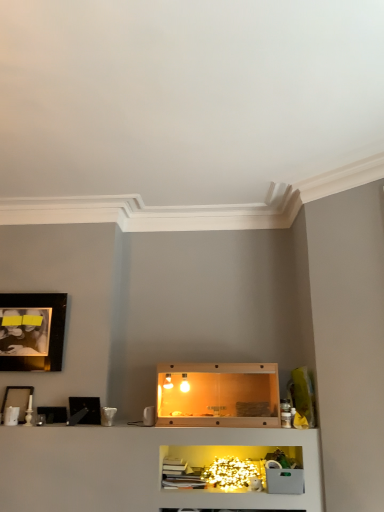
Question: Would you say translucent glass shelf at center is to the left or to the right of black glossy picture frame at left, acting as the third picture frame starting from the top, in the picture?

Choices:
 (A) right
 (B) left

Answer: (A)

Question: From the image's perspective, is translucent glass shelf at center positioned above or below black glossy picture frame at left, acting as the third picture frame starting from the top?

Choices:
 (A) above
 (B) below

Answer: (A)

Question: Which object is the closest to the translucent glass shelf at center?

Choices:
 (A) black glossy picture frame at left, which is the 3th picture frame in left-to-right order
 (B) black glossy photo frame at upper left, marked as the 3th picture frame in a bottom-to-top arrangement
 (C) matte black picture frame at upper left, which ranks as the 3th picture frame in right-to-left order

Answer: (A)

Question: Which of these objects is positioned farthest from the black glossy picture frame at left, acting as the third picture frame starting from the top?

Choices:
 (A) matte black picture frame at upper left, positioned as the first picture frame in left-to-right order
 (B) translucent glass shelf at center
 (C) black glossy photo frame at upper left, which ranks as the second picture frame in right-to-left order

Answer: (B)